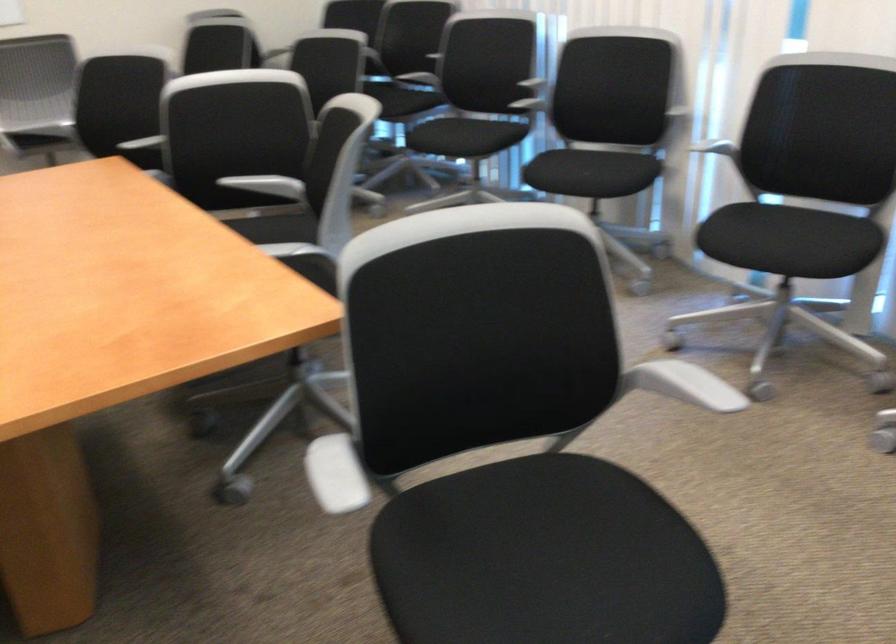
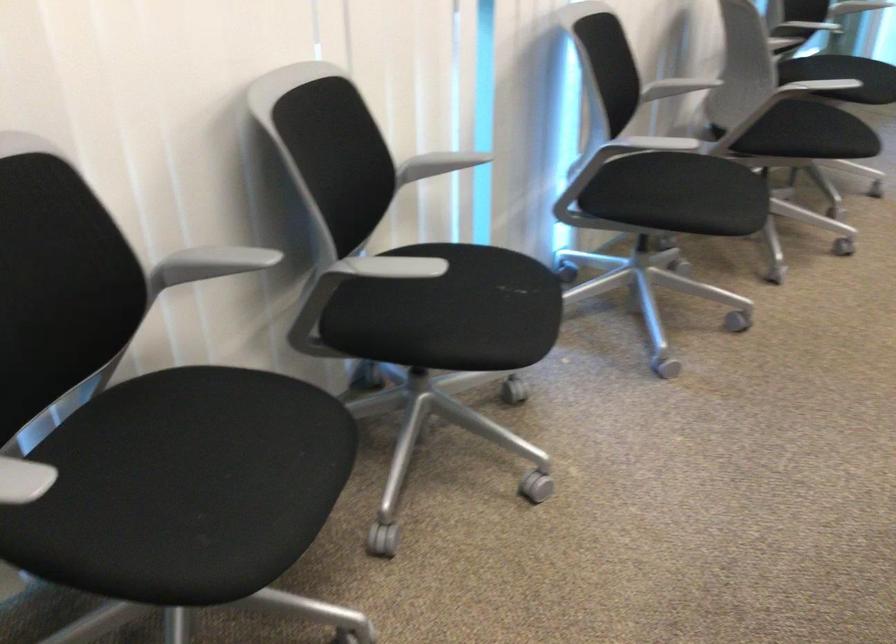
Locate, in the second image, the point that corresponds to (460,134) in the first image.

(226, 456)